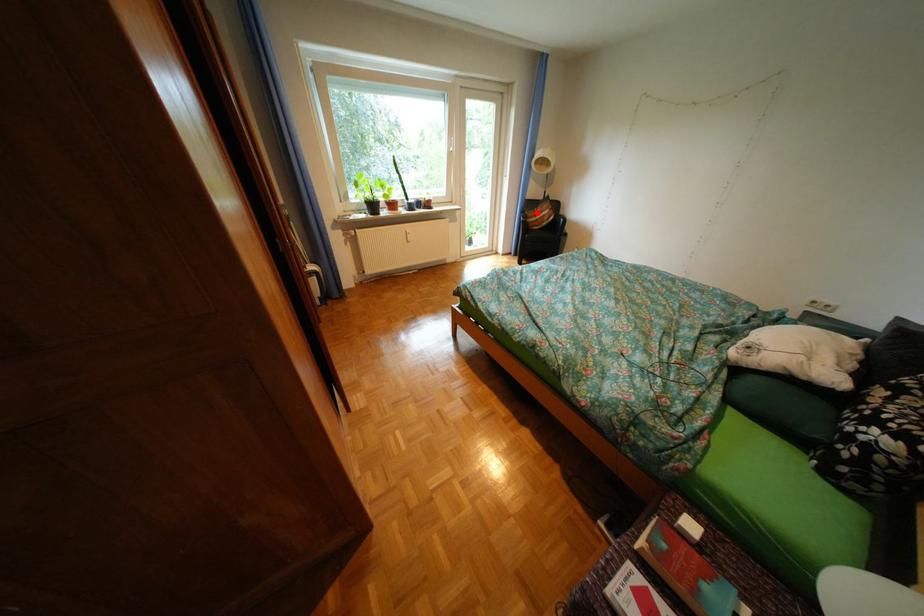
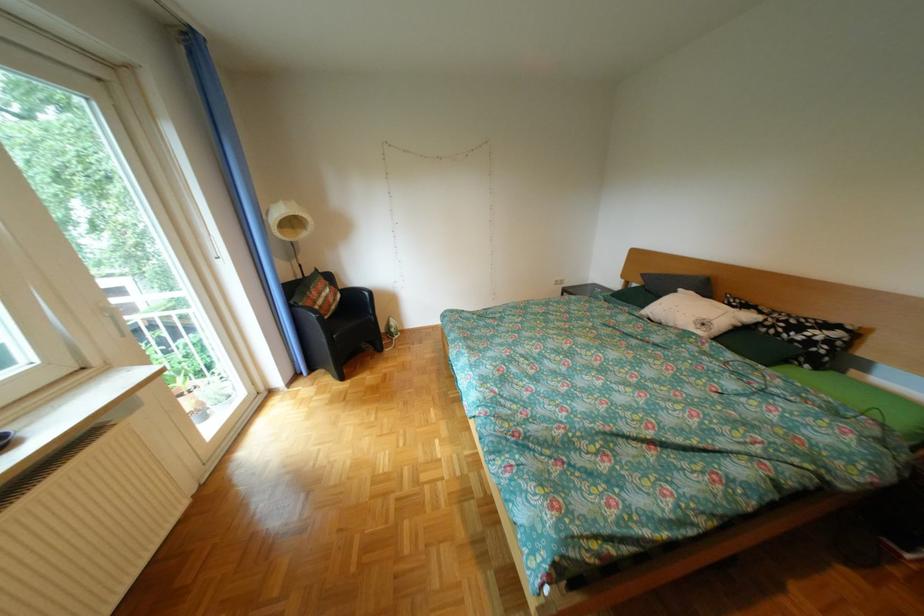
Where in the second image is the point corresponding to the highlighted location from the first image?

(306, 307)